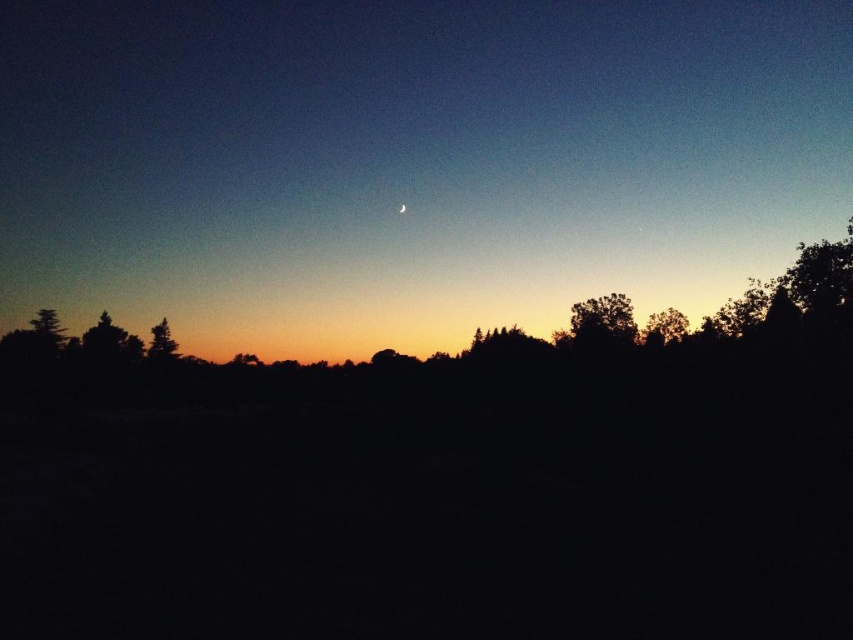
Question: Which object is positioned farthest from the silvery crescent moon at center?

Choices:
 (A) green matte tree at lower left
 (B) green leafy tree at center-right
 (C) green matte tree at left
 (D) bright silver crescent at upper center

Answer: (A)

Question: Is green leafy tree at right behind bright silver crescent at upper center?

Choices:
 (A) no
 (B) yes

Answer: (A)

Question: Which point is closer to the camera?

Choices:
 (A) (173, 348)
 (B) (53, 337)
 (C) (672, 323)

Answer: (C)

Question: Among these objects, which one is farthest from the camera?

Choices:
 (A) green leafy tree at center-right
 (B) green matte tree at lower left
 (C) green matte tree at left
 (D) green leafy tree at right

Answer: (B)

Question: Does green matte tree at left have a lesser width compared to green matte tree at lower left?

Choices:
 (A) no
 (B) yes

Answer: (A)

Question: Can you confirm if silvery crescent moon at center is positioned below green matte tree at left?

Choices:
 (A) yes
 (B) no

Answer: (B)